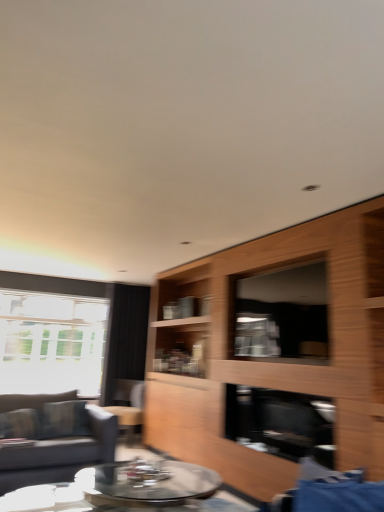
Question: Does wooden cabinet at center have a lesser height compared to black fabric curtain at left?

Choices:
 (A) no
 (B) yes

Answer: (A)

Question: Is wooden cabinet at center far away from black fabric curtain at left?

Choices:
 (A) no
 (B) yes

Answer: (B)

Question: Is black fabric curtain at left surrounded by wooden cabinet at center?

Choices:
 (A) no
 (B) yes

Answer: (A)

Question: Is black fabric curtain at left at the back of wooden cabinet at center?

Choices:
 (A) yes
 (B) no

Answer: (B)

Question: From a real-world perspective, is wooden cabinet at center under black fabric curtain at left?

Choices:
 (A) no
 (B) yes

Answer: (B)

Question: In terms of height, does black fabric curtain at left look taller or shorter compared to dark gray fabric couch at left?

Choices:
 (A) tall
 (B) short

Answer: (A)

Question: Considering the positions of point (109, 387) and point (8, 480), is point (109, 387) closer or farther from the camera than point (8, 480)?

Choices:
 (A) farther
 (B) closer

Answer: (A)

Question: Looking at the image, does black fabric curtain at left seem bigger or smaller compared to dark gray fabric couch at left?

Choices:
 (A) big
 (B) small

Answer: (B)

Question: Considering the positions of black fabric curtain at left and dark gray fabric couch at left in the image, is black fabric curtain at left wider or thinner than dark gray fabric couch at left?

Choices:
 (A) thin
 (B) wide

Answer: (A)

Question: Considering the positions of wooden cabinet at center and dark gray fabric couch at left in the image, is wooden cabinet at center wider or thinner than dark gray fabric couch at left?

Choices:
 (A) thin
 (B) wide

Answer: (A)

Question: Is wooden cabinet at center taller or shorter than dark gray fabric couch at left?

Choices:
 (A) tall
 (B) short

Answer: (A)

Question: From a real-world perspective, is wooden cabinet at center physically located above or below dark gray fabric couch at left?

Choices:
 (A) above
 (B) below

Answer: (A)

Question: In the image, is wooden cabinet at center positioned in front of or behind dark gray fabric couch at left?

Choices:
 (A) front
 (B) behind

Answer: (A)

Question: Looking at the image, does wooden cabinet at center seem bigger or smaller compared to transparent glass window screen at center?

Choices:
 (A) small
 (B) big

Answer: (B)

Question: Choose the correct answer: Is wooden cabinet at center inside transparent glass window screen at center or outside it?

Choices:
 (A) inside
 (B) outside

Answer: (B)